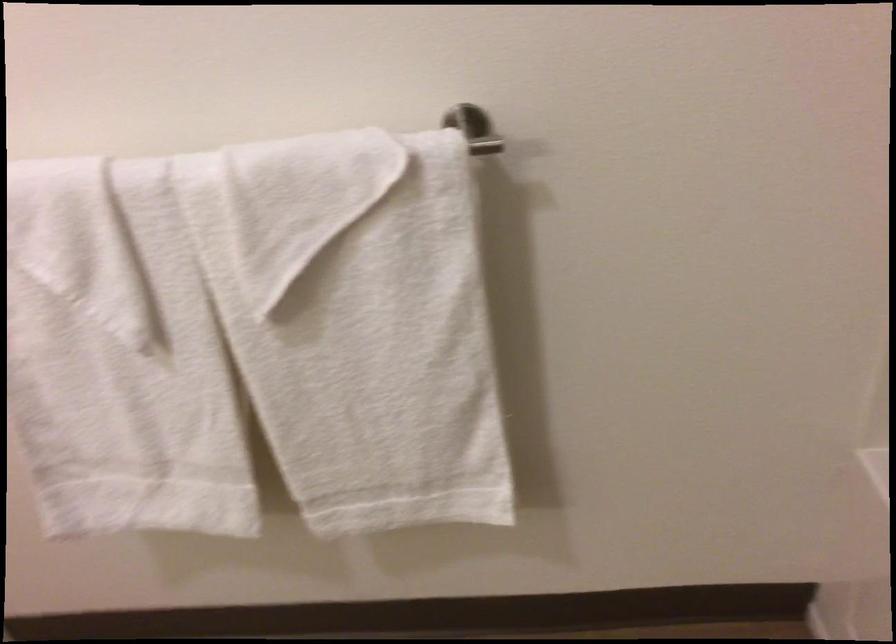
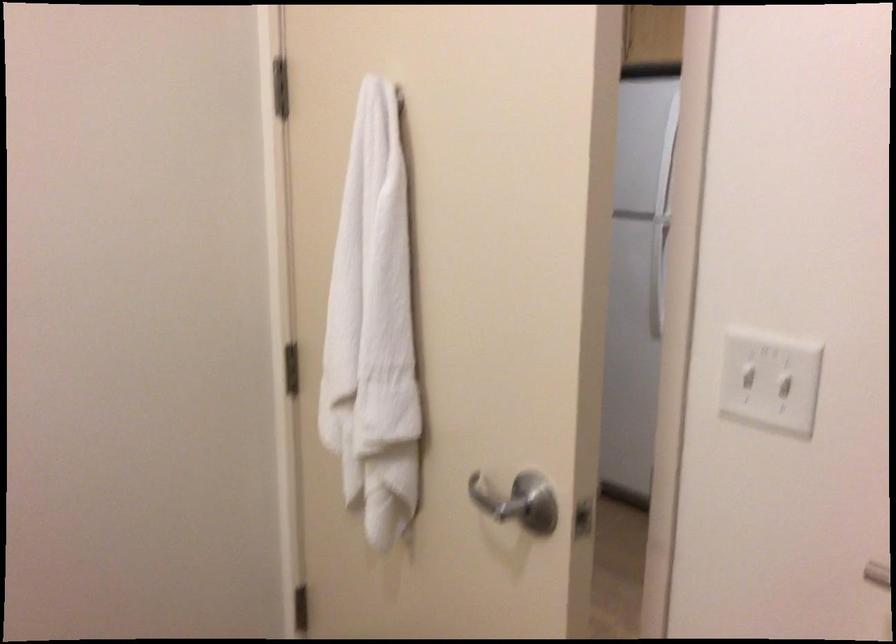
Question: How did the camera likely rotate?

Choices:
 (A) Left
 (B) Right
 (C) Up
 (D) Down

Answer: (A)